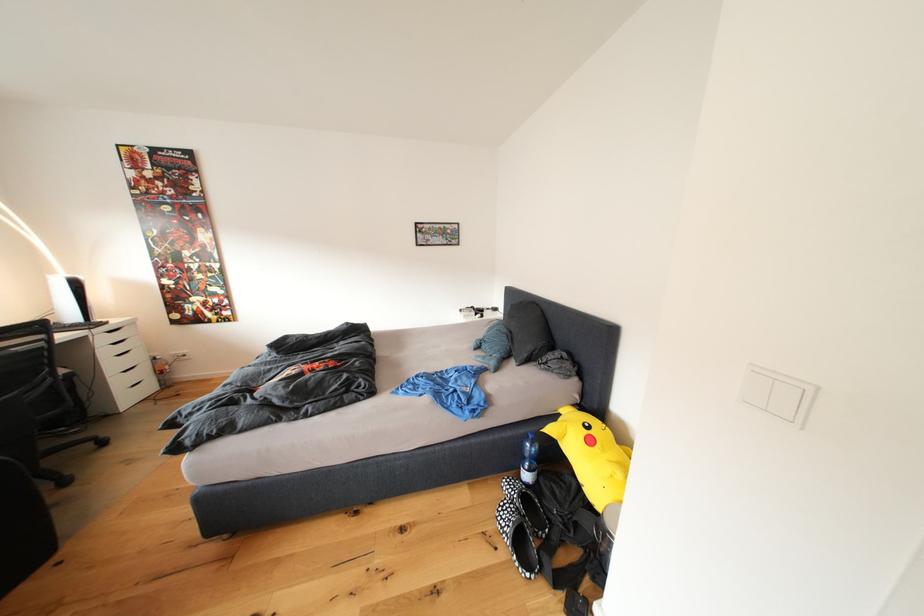
Locate an element on the screen. The width and height of the screenshot is (924, 616). plastic water bottle is located at coordinates (529, 460).